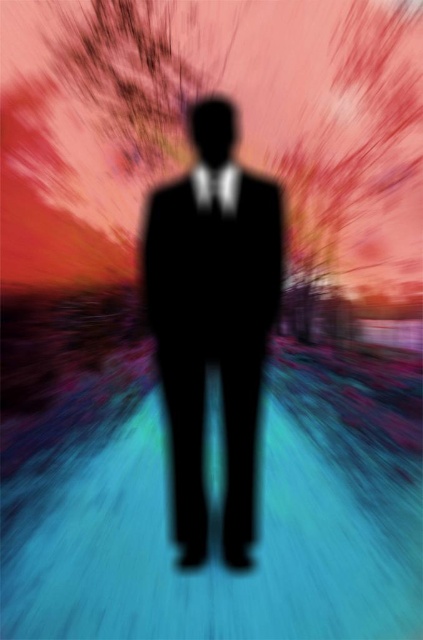
Between black matte suit at center and matte black tie at center, which one appears on the right side from the viewer's perspective?

Positioned to the right is matte black tie at center.

Based on the photo, is black matte suit at center above matte black tie at center?

Actually, black matte suit at center is below matte black tie at center.

In order to click on black matte suit at center in this screenshot , I will do `click(213, 321)`.

Can you confirm if smooth pink tree at upper left is smaller than matte black tie at center?

A: No.

Can you confirm if smooth pink tree at upper left is positioned to the right of matte black tie at center?

Incorrect, smooth pink tree at upper left is not on the right side of matte black tie at center.

Is point (82, 81) more distant than point (220, 177)?

Yes, point (82, 81) is farther from viewer.

The image size is (423, 640). Find the location of `smooth pink tree at upper left`. smooth pink tree at upper left is located at coordinates coord(136,74).

Is black matte suit at center shorter than smooth pink tree at upper left?

No, black matte suit at center is not shorter than smooth pink tree at upper left.

Identify the location of black matte suit at center. (213, 321).